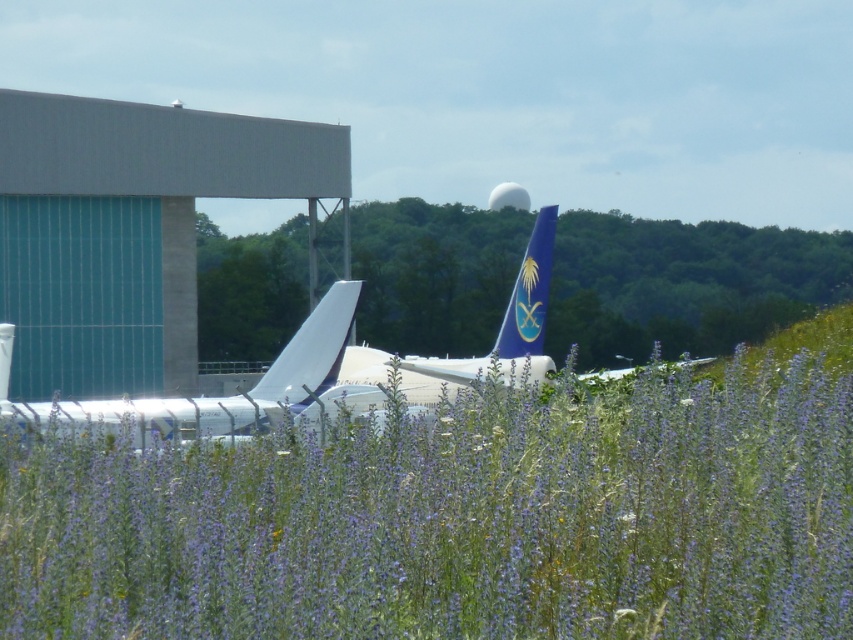
Who is positioned more to the left, purple grass at center or blue glossy tail fin at center?

From the viewer's perspective, purple grass at center appears more on the left side.

The image size is (853, 640). Describe the element at coordinates (457, 518) in the screenshot. I see `purple grass at center` at that location.

Is point (161, 556) positioned behind point (509, 307)?

No, (161, 556) is closer to viewer.

Locate an element on the screen. purple grass at center is located at coordinates (457, 518).

Does point (335, 346) come in front of point (514, 337)?

Yes, it is.

Is white matte tail at center bigger than blue glossy tail fin at center?

Indeed, white matte tail at center has a larger size compared to blue glossy tail fin at center.

Does point (299, 346) lie in front of point (548, 284)?

Yes, it is.

Locate an element on the screen. The height and width of the screenshot is (640, 853). white matte tail at center is located at coordinates (312, 349).

This screenshot has width=853, height=640. I want to click on white glossy airplane at center, so click(209, 396).